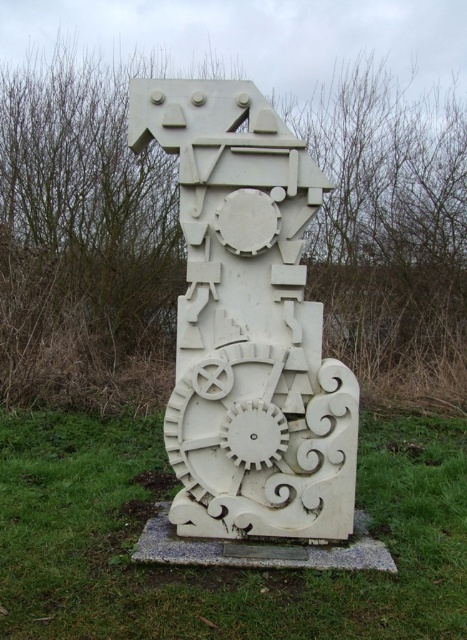
You are an artist planning to place a new sculpture next to the existing ones in the image. You have a sculpture that is 1 meter wide. Can you determine if there is enough space between the white carved gear at center and the white marble sculpture at center to place your new sculpture?

The white carved gear at center might be wider than the white marble sculpture at center, so it is uncertain if there is enough space between them to place your 1 meter wide sculpture. Check the actual dimensions before deciding.

Based on the photo, you are an art student analyzing the sculpture. You notice two central elements, the white carved gear at center and the white marble sculpture at center. Which one has a greater height?

The white marble sculpture at center is taller than the white carved gear at center.

You are an art student analyzing the sculpture. You notice two central elements, the white carved gear at center and the white marble sculpture at center. Which one is positioned lower in the structure?

The white carved gear at center is positioned lower than the white marble sculpture at center.